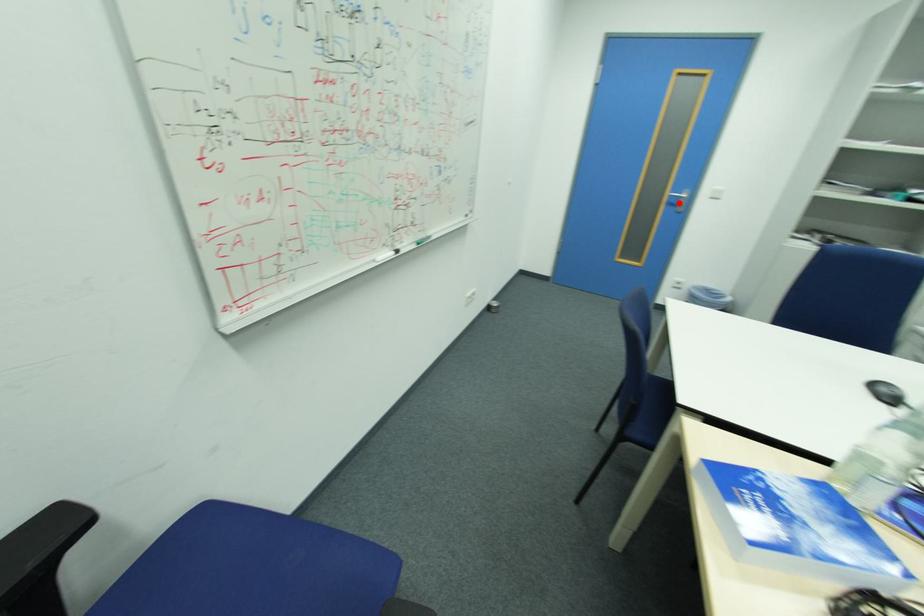
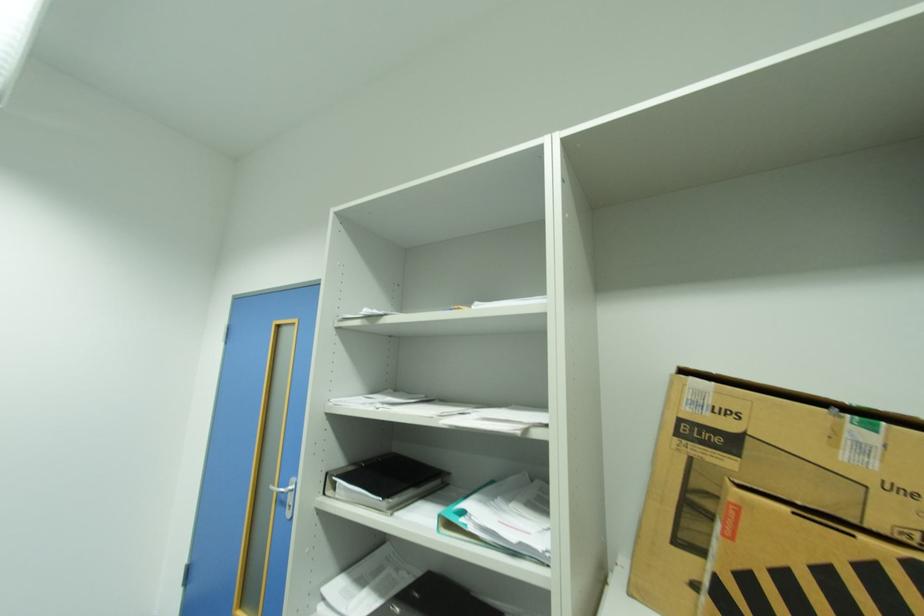
Find the pixel in the second image that matches the highlighted location in the first image.

(287, 498)